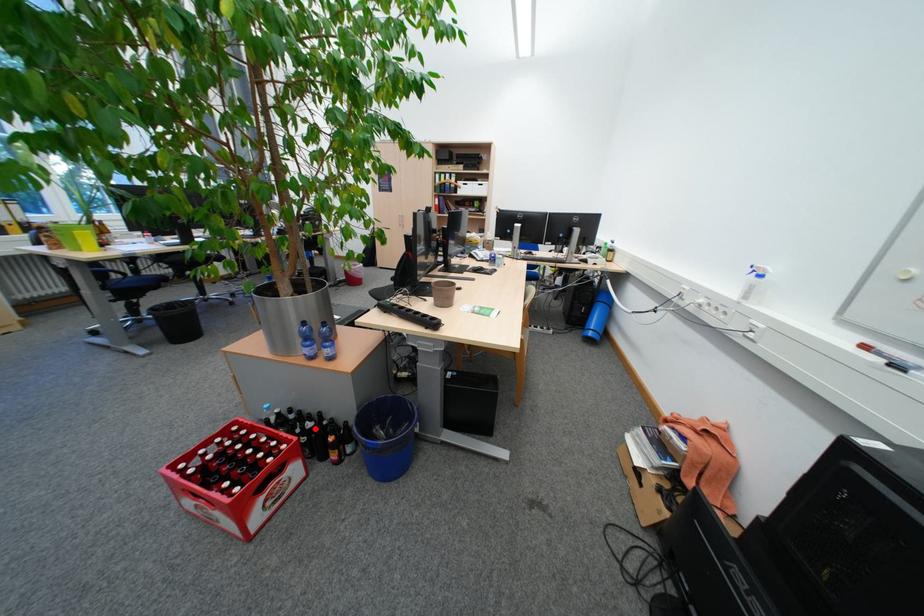
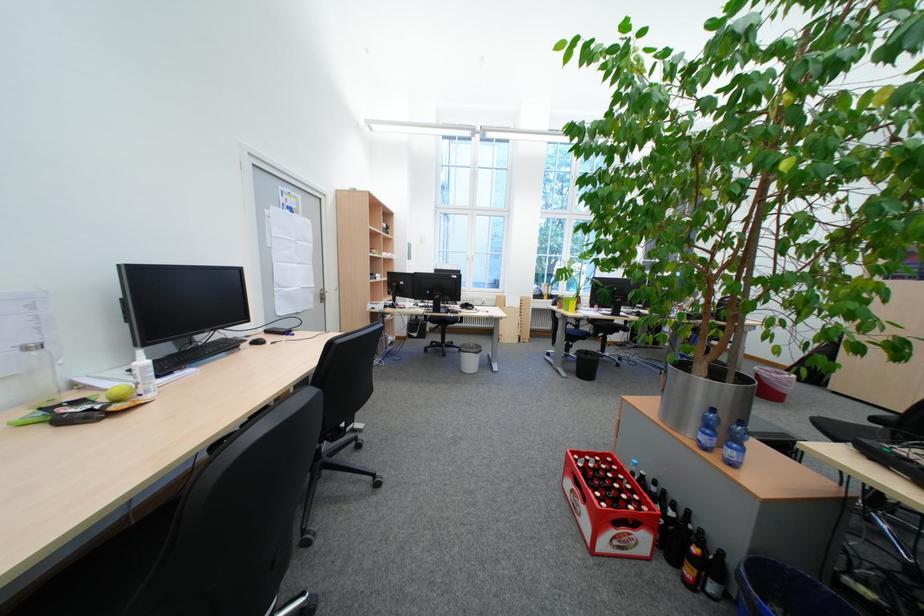
Question: I am providing you with two images of the same scene from different viewpoints. Image1 has a red point marked. In image2, the corresponding 3D location appears at what relative position? Reply with the corresponding letter.

Choices:
 (A) Closer
 (B) Farther

Answer: (A)